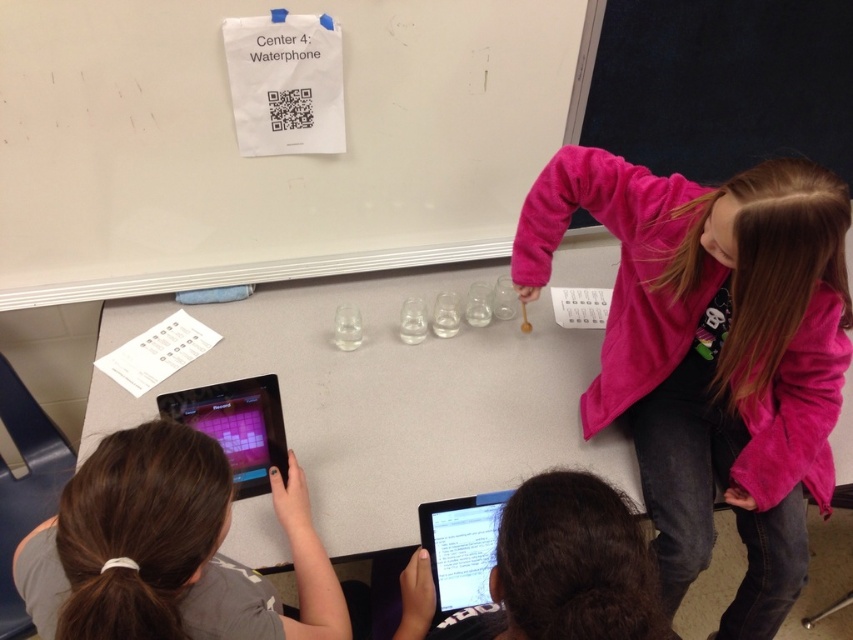
Question: Can you confirm if pink fleece jacket at upper right is smaller than gray fabric shirt at lower left?

Choices:
 (A) no
 (B) yes

Answer: (A)

Question: In this image, where is gray matte table at center located relative to black glossy tablet at lower center?

Choices:
 (A) right
 (B) left

Answer: (B)

Question: Which point is closer to the camera?

Choices:
 (A) (274, 602)
 (B) (376, 205)
 (C) (165, 416)
 (D) (547, 209)

Answer: (A)

Question: Can you confirm if gray matte table at center is wider than dark blue fabric at upper right?

Choices:
 (A) no
 (B) yes

Answer: (B)

Question: Which is nearer to the gray fabric shirt at lower left?

Choices:
 (A) white paper at center
 (B) black glossy tablet at lower center
 (C) gray fabric shirt at lower center
 (D) dark blue fabric at upper right

Answer: (B)

Question: Which point is closer to the camera?

Choices:
 (A) gray fabric shirt at lower center
 (B) gray fabric shirt at lower left
 (C) gray matte table at center

Answer: (A)